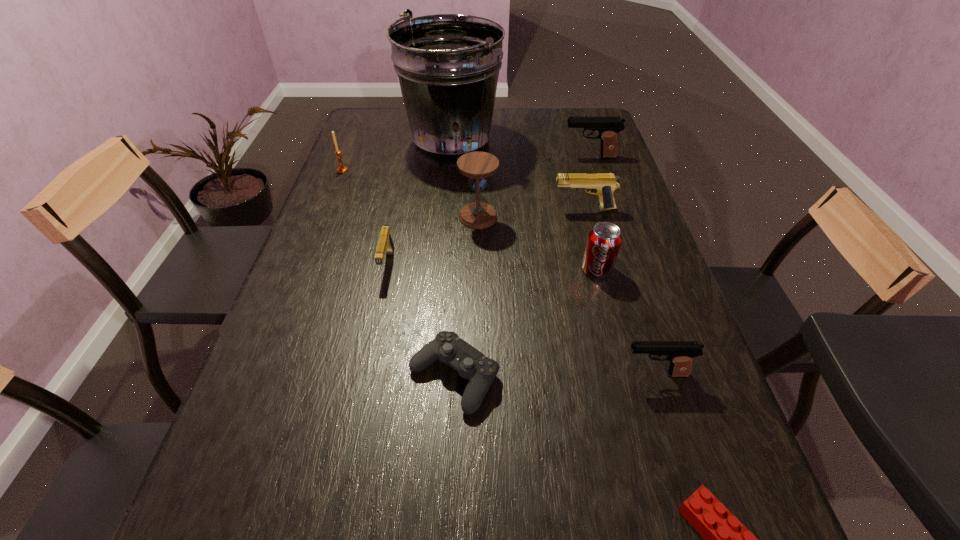
Locate an element on the screen. This screenshot has width=960, height=540. soda can positioned at the right edge is located at coordinates (604, 240).

At what (x,y) coordinates should I click in order to perform the action: click on vacant space at the far edge of the desktop. Please return your answer as a coordinate pair (x, y). The image size is (960, 540). Looking at the image, I should click on (544, 126).

Where is `vacant space at the left edge of the desktop`? The width and height of the screenshot is (960, 540). vacant space at the left edge of the desktop is located at coordinates (318, 401).

You are a GUI agent. You are given a task and a screenshot of the screen. Output one action in this format:
    pyautogui.click(x=<x>, y=<y>)
    Task: Click on the free space at the right edge of the desktop
    The image size is (960, 540).
    Given the screenshot: What is the action you would take?
    pyautogui.click(x=706, y=389)

Locate an element on the screen. The width and height of the screenshot is (960, 540). vacant space at the far left corner of the desktop is located at coordinates (394, 119).

The height and width of the screenshot is (540, 960). I want to click on free spot between the nearest pistol and the soda can, so click(626, 321).

The image size is (960, 540). I want to click on free space between the third shortest object and the ninth tallest object, so click(x=420, y=320).

Identify the location of unoccupied position between the hourglass and the bucket. (465, 180).

Find the location of a particular element. Image resolution: width=960 pixels, height=540 pixels. free space between the tallest object and the third farthest pistol is located at coordinates (420, 204).

This screenshot has width=960, height=540. Identify the location of free space between the tallest object and the soda can. (524, 206).